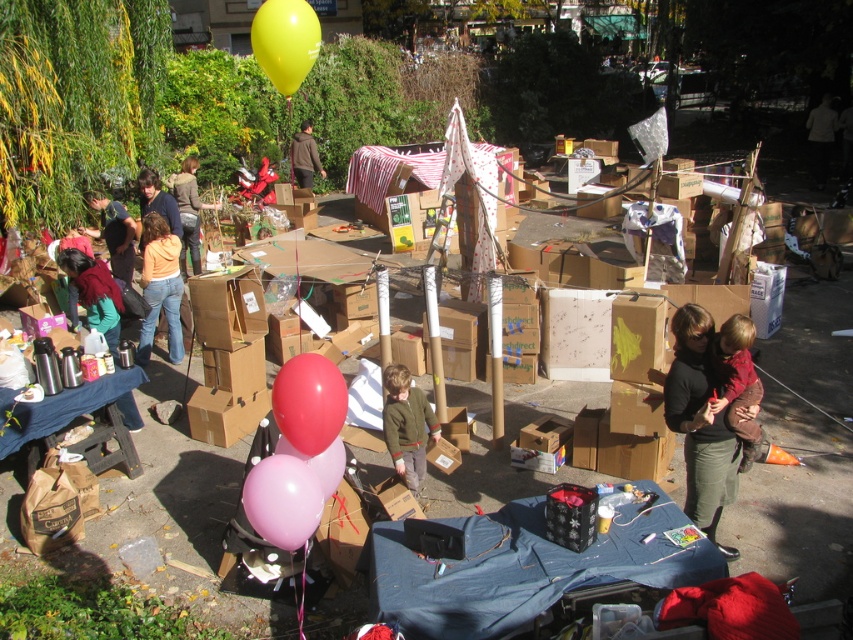
Which of these two, pink rubber balloon at center or brown soft jacket at center, stands shorter?

Standing shorter between the two is pink rubber balloon at center.

What are the coordinates of `pink rubber balloon at center` in the screenshot? It's located at (318, 461).

Does point (341, 474) come behind point (318, 163)?

No, it is not.

You are a GUI agent. You are given a task and a screenshot of the screen. Output one action in this format:
    pyautogui.click(x=<x>, y=<y>)
    Task: Click on the pink rubber balloon at center
    The width and height of the screenshot is (853, 640).
    Given the screenshot: What is the action you would take?
    point(318,461)

Which is below, green wool sweater at center or brown soft jacket at center?

green wool sweater at center

Does green wool sweater at center have a greater width compared to brown soft jacket at center?

No, green wool sweater at center is not wider than brown soft jacket at center.

Is point (405, 404) closer to viewer compared to point (308, 147)?

Yes, point (405, 404) is in front of point (308, 147).

Where is `green wool sweater at center`? This screenshot has height=640, width=853. green wool sweater at center is located at coordinates (407, 426).

Which is above, jeans at center or pink rubber balloon at center?

jeans at center

Between jeans at center and pink rubber balloon at center, which one has more height?

Standing taller between the two is jeans at center.

Is point (183, 179) farther from viewer compared to point (328, 474)?

Yes, it is behind point (328, 474).

Identify the location of jeans at center. The width and height of the screenshot is (853, 640). (189, 209).